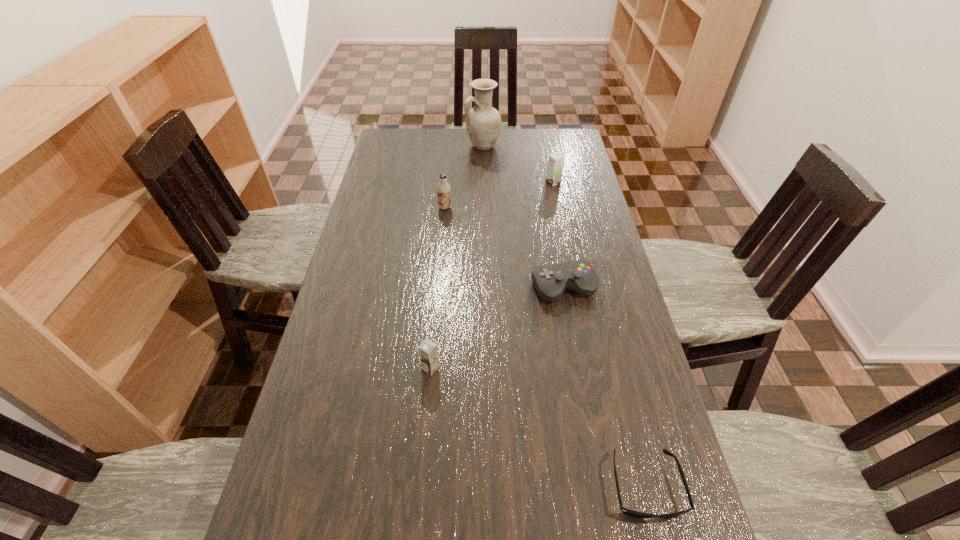
Locate an element on the screen. The width and height of the screenshot is (960, 540). vacant space that satisfies the following two spatial constraints: 1. on the back side of the fourth object from right to left; 2. on the right side of the shortest chocolate milk is located at coordinates (450, 146).